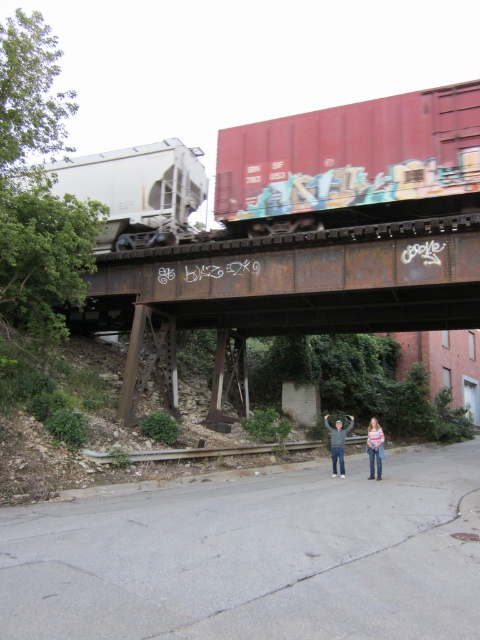
You are a photographer standing on the bridge in the scene. You want to take a photo of the red matte freight car at upper center. Where should you position yourself to capture it in the frame?

You should position yourself at the point corresponding to coordinates approximately 0.253 on the x axis and 0.729 on the y axis to capture the red matte freight car at upper center in the frame.

You are a photographer standing at the point marked by the coordinates in the image. You want to capture a photo of the rusty metal train bridge at center. Since you are at point point (x=290, y=284), which is the location of the bridge, can you take a clear photo of the bridge from your current position?

The point (x=290, y=284) marks the rusty metal train bridge at center, so you are standing at the bridge itself. Therefore, you cannot take a clear photo of the bridge from your current position because you are on the bridge.